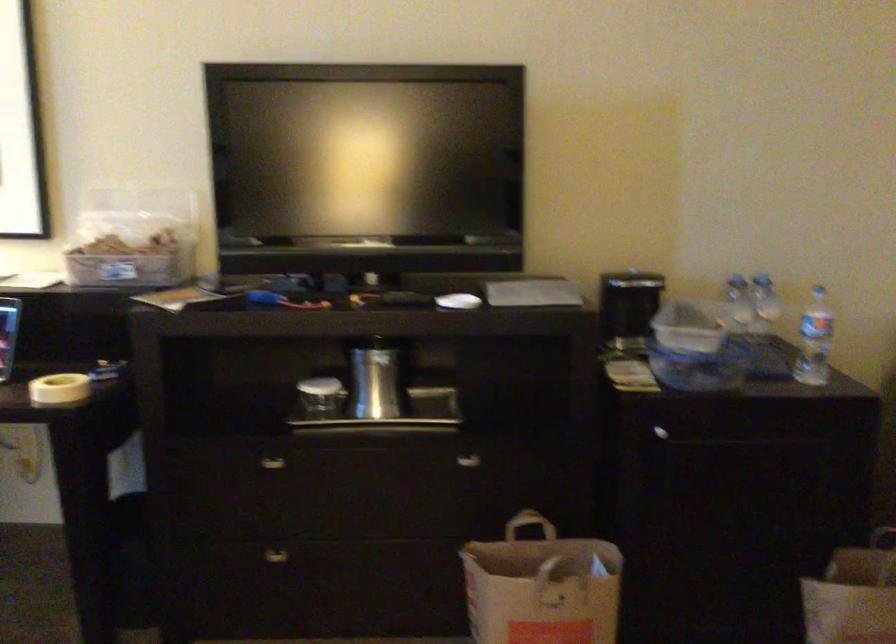
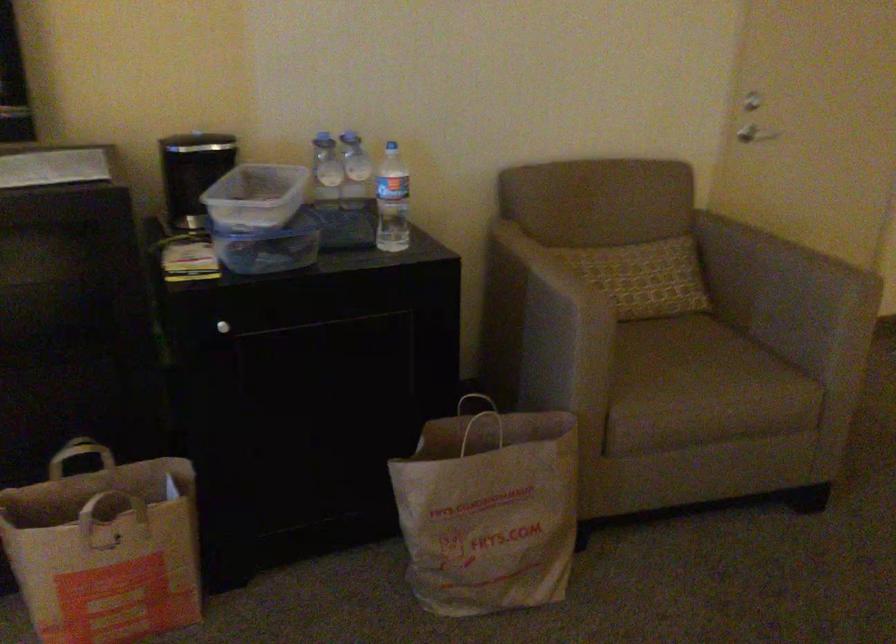
In the second image, find the point that corresponds to point 814,333 in the first image.

(391, 201)